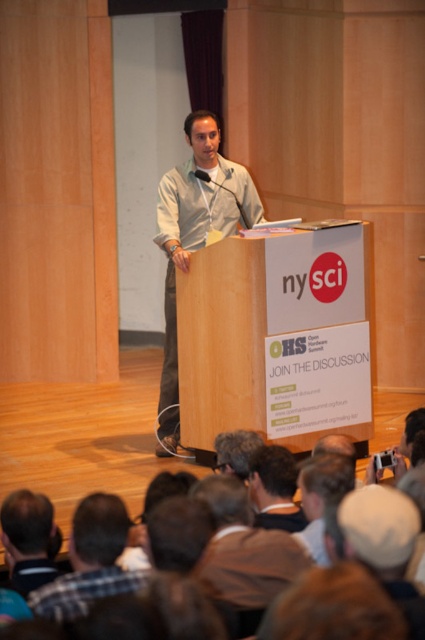
You are a speaker standing at the podium during the OHS Open Hardware Summit. You want to make sure your presentation is visible to everyone in the brown fabric crowd at lower center. Where should you position yourself relative to the podium to best address the crowd?

The brown fabric crowd at lower center is located at point (79, 445). To best address them, you should position yourself centrally behind the podium, facing towards the coordinates of the crowd to ensure clear visibility and engagement.